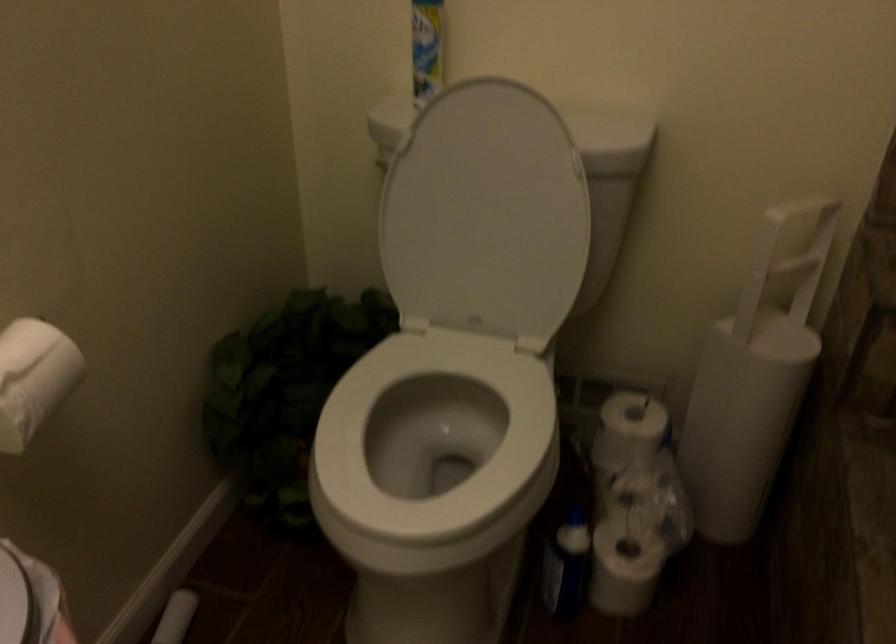
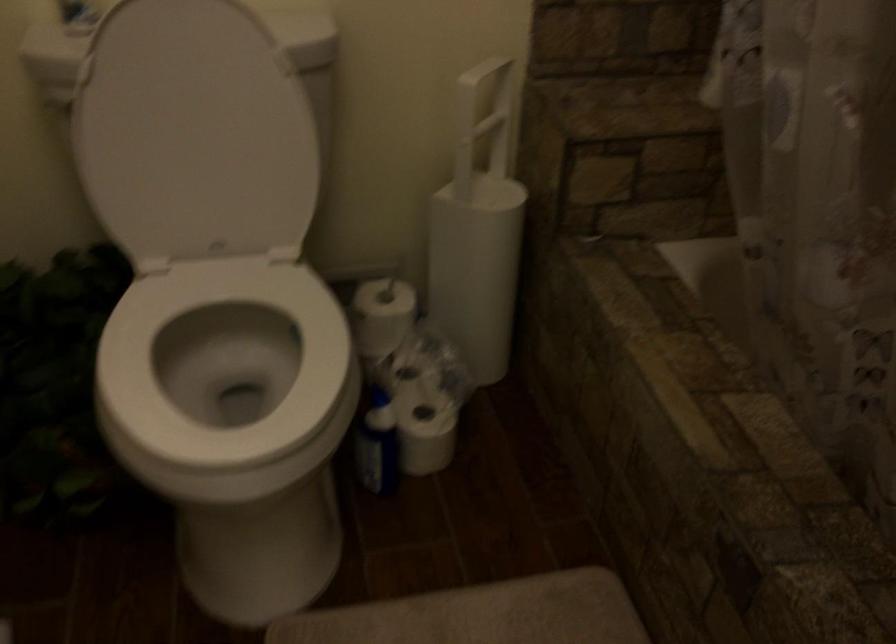
Where in the second image is the point corresponding to pixel 446 431 from the first image?

(224, 365)